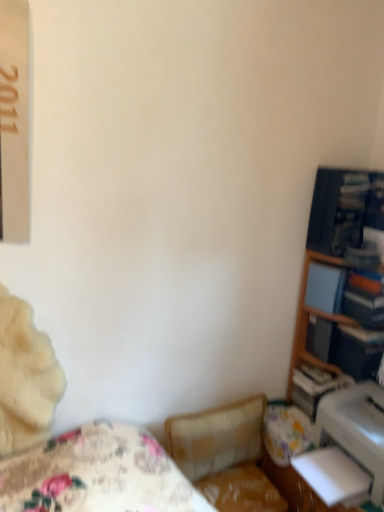
Locate an element on the screen. The width and height of the screenshot is (384, 512). wooden bookshelf at right is located at coordinates (340, 287).

Find the location of a particular element. Image resolution: width=384 pixels, height=512 pixels. wooden bookshelf at right is located at coordinates (340, 287).

Does hardcover book at right, which is counted as the first paperback book, starting from the right, have a larger size compared to wooden bookshelf at right?

Actually, hardcover book at right, which is counted as the first paperback book, starting from the right, might be smaller than wooden bookshelf at right.

Is hardcover book at right, which is counted as the first paperback book, starting from the right, with wooden bookshelf at right?

No.

Is hardcover book at right, placed as the 2th paperback book when sorted from top to bottom, wider than wooden bookshelf at right?

No, hardcover book at right, placed as the 2th paperback book when sorted from top to bottom, is not wider than wooden bookshelf at right.

Is hardcover book at right, which is counted as the first paperback book, starting from the right, taller than wooden bookshelf at right?

No.

Relative to white glossy printer at lower right, is plush beige swivel chair at center in front or behind?

plush beige swivel chair at center is behind white glossy printer at lower right.

Is point (237, 463) more distant than point (373, 442)?

Yes, point (237, 463) is behind point (373, 442).

In the scene shown: Could you tell me if plush beige swivel chair at center is turned towards white glossy printer at lower right?

No, plush beige swivel chair at center is not facing towards white glossy printer at lower right.

Which object is closer to the camera taking this photo, wooden bookshelf at right or matte blue paperback book at right, which appears as the first paperback book when viewed from the left?

wooden bookshelf at right.

From a real-world perspective, is wooden bookshelf at right below matte blue paperback book at right, which appears as the first paperback book when viewed from the left?

No.

Between wooden bookshelf at right and matte blue paperback book at right, the first paperback book when ordered from top to bottom, which one has more height?

Standing taller between the two is wooden bookshelf at right.

Are wooden bookshelf at right and matte blue paperback book at right, the 2th paperback book when ordered from bottom to top, located far from each other?

wooden bookshelf at right is actually quite close to matte blue paperback book at right, the 2th paperback book when ordered from bottom to top.

Is white glossy printer at lower right to the left or to the right of wooden bookshelf at right in the image?

white glossy printer at lower right is positioned on wooden bookshelf at right's left side.

Can wooden bookshelf at right be found inside white glossy printer at lower right?

No, white glossy printer at lower right does not contain wooden bookshelf at right.

From a real-world perspective, is white glossy printer at lower right physically below wooden bookshelf at right?

Yes, from a real-world perspective, white glossy printer at lower right is beneath wooden bookshelf at right.

In the scene shown: From the image's perspective, relative to wooden bookshelf at right, is white glossy printer at lower right above or below?

Clearly, from the image's perspective, white glossy printer at lower right is below wooden bookshelf at right.

Is white glossy printer at lower right directly adjacent to plush beige swivel chair at center?

They are not placed beside each other.

Between white glossy printer at lower right and plush beige swivel chair at center, which one has smaller size?

With smaller size is white glossy printer at lower right.

Is white glossy printer at lower right behind plush beige swivel chair at center?

No, it is not.

Looking at their sizes, would you say white glossy printer at lower right is wider or thinner than plush beige swivel chair at center?

white glossy printer at lower right is wider than plush beige swivel chair at center.

Who is shorter, matte blue paperback book at right, the second paperback book viewed from the right, or wooden bookshelf at right?

matte blue paperback book at right, the second paperback book viewed from the right, is shorter.

From a real-world perspective, does matte blue paperback book at right, which appears as the first paperback book when viewed from the left, stand above wooden bookshelf at right?

No.

Based on the photo, is matte blue paperback book at right, the first paperback book when ordered from top to bottom, not close to wooden bookshelf at right?

That's not correct — matte blue paperback book at right, the first paperback book when ordered from top to bottom, is a little close to wooden bookshelf at right.

Which object is closer to the camera taking this photo, matte blue paperback book at right, the second paperback book viewed from the right, or wooden bookshelf at right?

wooden bookshelf at right is closer to the camera.

Measure the distance between hardcover book at right, placed as the 2th paperback book when sorted from top to bottom, and matte blue paperback book at right, the second paperback book viewed from the right.

The distance of hardcover book at right, placed as the 2th paperback book when sorted from top to bottom, from matte blue paperback book at right, the second paperback book viewed from the right, is 7.10 inches.

From a real-world perspective, is hardcover book at right, which is counted as the first paperback book, starting from the right, positioned over matte blue paperback book at right, the first paperback book when ordered from top to bottom, based on gravity?

Actually, hardcover book at right, which is counted as the first paperback book, starting from the right, is physically below matte blue paperback book at right, the first paperback book when ordered from top to bottom, in the real world.

From the image's perspective, which object appears higher, hardcover book at right, positioned as the 1th paperback book in bottom-to-top order, or matte blue paperback book at right, the first paperback book when ordered from top to bottom?

matte blue paperback book at right, the first paperback book when ordered from top to bottom.

Considering the sizes of hardcover book at right, placed as the 2th paperback book when sorted from top to bottom, and matte blue paperback book at right, the second paperback book viewed from the right, in the image, is hardcover book at right, placed as the 2th paperback book when sorted from top to bottom, taller or shorter than matte blue paperback book at right, the second paperback book viewed from the right,?

Considering their sizes, hardcover book at right, placed as the 2th paperback book when sorted from top to bottom, has less height than matte blue paperback book at right, the second paperback book viewed from the right.

Identify the location of bookshelf located in front of the hardcover book at right, the 2th paperback book viewed from the left. Image resolution: width=384 pixels, height=512 pixels. (340, 287).

This screenshot has height=512, width=384. What are the coordinates of `printer located on the right of plush beige swivel chair at center` in the screenshot? It's located at (356, 429).

Based on their spatial positions, is wooden bookshelf at right or plush beige swivel chair at center closer to white glossy printer at lower right?

wooden bookshelf at right is positioned closer to the anchor white glossy printer at lower right.

Based on their spatial positions, is wooden bookshelf at right or hardcover book at right, the 2th paperback book viewed from the left, closer to wooden bookshelf at right?

wooden bookshelf at right lies closer to wooden bookshelf at right than the other object.

Estimate the real-world distances between objects in this image. Which object is closer to plush beige swivel chair at center, matte blue paperback book at right, the second paperback book viewed from the right, or hardcover book at right, the 2th paperback book viewed from the left?

Based on the image, hardcover book at right, the 2th paperback book viewed from the left, appears to be nearer to plush beige swivel chair at center.

Based on their spatial positions, is hardcover book at right, which is counted as the first paperback book, starting from the right, or white glossy printer at lower right further from plush beige swivel chair at center?

hardcover book at right, which is counted as the first paperback book, starting from the right, lies further to plush beige swivel chair at center than the other object.

Based on their spatial positions, is matte blue paperback book at right, the first paperback book when ordered from top to bottom, or plush beige swivel chair at center further from hardcover book at right, the 2th paperback book viewed from the left?

plush beige swivel chair at center lies further to hardcover book at right, the 2th paperback book viewed from the left, than the other object.

Considering their positions, is wooden bookshelf at right positioned closer to matte blue paperback book at right, the 2th paperback book when ordered from bottom to top, than plush beige swivel chair at center?

wooden bookshelf at right lies closer to matte blue paperback book at right, the 2th paperback book when ordered from bottom to top, than the other object.

Based on their spatial positions, is wooden bookshelf at right or hardcover book at right, positioned as the 1th paperback book in bottom-to-top order, closer to matte blue paperback book at right, the first paperback book when ordered from top to bottom?

hardcover book at right, positioned as the 1th paperback book in bottom-to-top order, is positioned closer to the anchor matte blue paperback book at right, the first paperback book when ordered from top to bottom.

When comparing their distances from wooden bookshelf at right, does white glossy printer at lower right or matte blue paperback book at right, the second paperback book viewed from the right, seem closer?

matte blue paperback book at right, the second paperback book viewed from the right.

Locate an element on the screen. Image resolution: width=384 pixels, height=512 pixels. bookshelf that lies between matte blue paperback book at right, the second paperback book viewed from the right, and white glossy printer at lower right from top to bottom is located at coordinates (340, 287).

The width and height of the screenshot is (384, 512). Find the location of `paperback book between wooden bookshelf at right and hardcover book at right, placed as the 2th paperback book when sorted from top to bottom, from top to bottom`. paperback book between wooden bookshelf at right and hardcover book at right, placed as the 2th paperback book when sorted from top to bottom, from top to bottom is located at coordinates point(325,288).

Identify the location of paperback book between wooden bookshelf at right and plush beige swivel chair at center from top to bottom. Image resolution: width=384 pixels, height=512 pixels. point(359,351).

At what (x,y) coordinates should I click in order to perform the action: click on paperback book between matte blue paperback book at right, the 2th paperback book when ordered from bottom to top, and white glossy printer at lower right vertically. Please return your answer as a coordinate pair (x, y). Looking at the image, I should click on (359, 351).